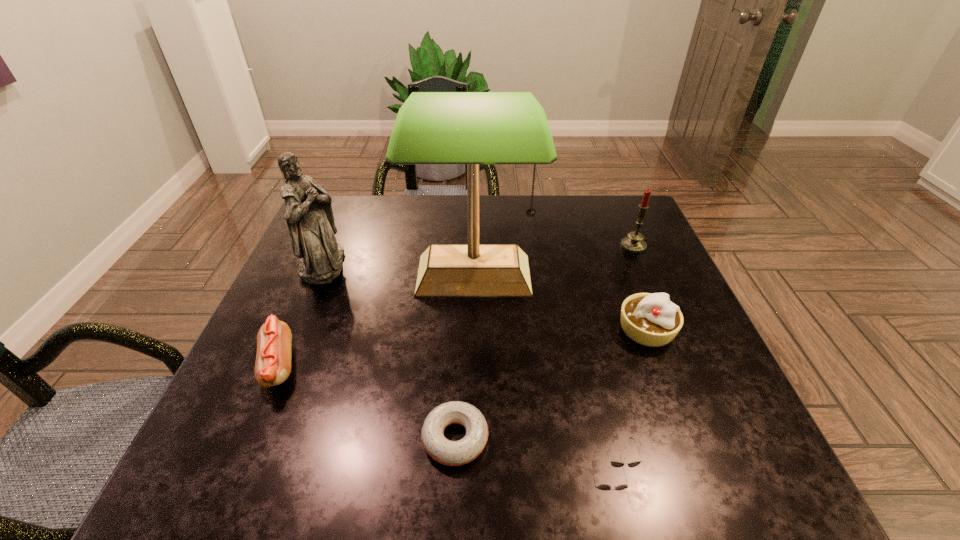
This screenshot has height=540, width=960. What are the coordinates of `vacant area between the table lamp and the fifth shortest object` in the screenshot? It's located at (554, 260).

At what (x,y) coordinates should I click in order to perform the action: click on unoccupied position between the doughnut and the tallest object. Please return your answer as a coordinate pair (x, y). This screenshot has width=960, height=540. Looking at the image, I should click on (465, 356).

This screenshot has height=540, width=960. Identify the location of unoccupied area between the sunglasses and the whipped cream. [632, 396].

The width and height of the screenshot is (960, 540). I want to click on empty location between the table lamp and the sixth shortest object, so click(398, 269).

The width and height of the screenshot is (960, 540). I want to click on free point between the figurine and the shortest object, so click(x=390, y=351).

The image size is (960, 540). Identify the location of free space between the fourth tallest object and the candle. (639, 288).

Locate which object is the third closest to the candle. Please provide its 2D coordinates. Your answer should be formatted as a tuple, i.e. [(x, y)], where the tuple contains the x and y coordinates of a point satisfying the conditions above.

[(617, 464)]

Select which object appears as the sixth closest to the second tallest object. Please provide its 2D coordinates. Your answer should be formatted as a tuple, i.e. [(x, y)], where the tuple contains the x and y coordinates of a point satisfying the conditions above.

[(633, 243)]

The width and height of the screenshot is (960, 540). I want to click on vacant space that satisfies the following two spatial constraints: 1. on the front-facing side of the sixth shortest object; 2. on the right side of the fourth tallest object, so click(x=296, y=329).

Where is `free location that satisfies the following two spatial constraints: 1. on the front-facing side of the figurine; 2. on the left side of the doughnut`? free location that satisfies the following two spatial constraints: 1. on the front-facing side of the figurine; 2. on the left side of the doughnut is located at coordinates (250, 438).